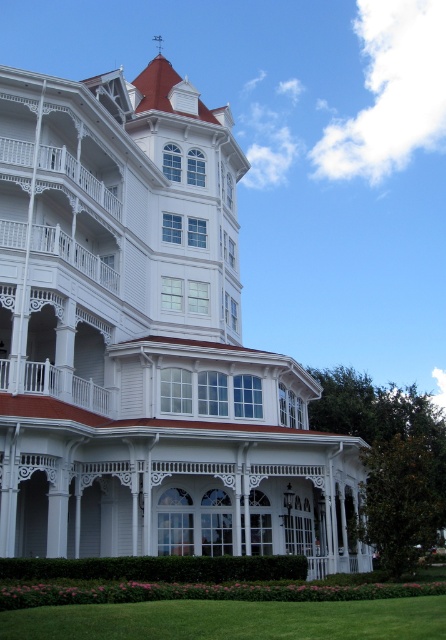
You are standing at the base of the grand Victorian building and want to place a small garden. The garden must be positioned exactly at the point where the green grass at lower center is located. What are the coordinates of this location?

The coordinates of the green grass at lower center are at point (x=231, y=620).

You are a photographer planning to capture the entire view of the white wood mansion at center and the white painted wood porch at left in one shot. Which object would require you to adjust your camera angle to avoid cropping due to its greater width?

The white wood mansion at center has a greater width than the white painted wood porch at left, so you would need to adjust your camera angle to accommodate its wider structure to avoid cropping.

You are a photographer planning to capture the white wood mansion at center and the green grass at lower center in a single frame. Given that the camera can only focus on one subject at a time, which object should you prioritize to ensure it fills most of the frame?

The white wood mansion at center is bigger than the green grass at lower center, so you should prioritize focusing on the white wood mansion at center to ensure it fills most of the frame.